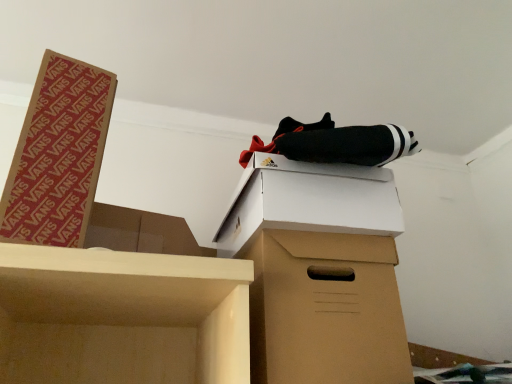
Question: Considering the relative sizes of brown cardboard box at left, which ranks as the second box in right-to-left order, and brown cardboard box at center in the image provided, is brown cardboard box at left, which ranks as the second box in right-to-left order, smaller than brown cardboard box at center?

Choices:
 (A) yes
 (B) no

Answer: (A)

Question: Can you confirm if brown cardboard box at left, the first box from the left, is positioned to the left of brown cardboard box at center?

Choices:
 (A) yes
 (B) no

Answer: (A)

Question: Is brown cardboard box at left, the first box from the left, touching brown cardboard box at center?

Choices:
 (A) no
 (B) yes

Answer: (A)

Question: From the image's perspective, is brown cardboard box at left, which ranks as the second box in right-to-left order, on brown cardboard box at center?

Choices:
 (A) no
 (B) yes

Answer: (B)

Question: Is brown cardboard box at left, which ranks as the second box in right-to-left order, taller than brown cardboard box at center?

Choices:
 (A) yes
 (B) no

Answer: (A)

Question: Does point (279, 213) appear closer or farther from the camera than point (64, 112)?

Choices:
 (A) closer
 (B) farther

Answer: (B)

Question: Looking at the image, does white cardboard box at upper center, which appears as the first box when viewed from the right, seem bigger or smaller compared to brown cardboard box at left, which ranks as the second box in right-to-left order?

Choices:
 (A) big
 (B) small

Answer: (A)

Question: Would you say white cardboard box at upper center, the second box viewed from the left, is to the left or to the right of brown cardboard box at left, the first box from the left, in the picture?

Choices:
 (A) left
 (B) right

Answer: (B)

Question: From a real-world perspective, is white cardboard box at upper center, the second box viewed from the left, above or below brown cardboard box at left, the first box from the left?

Choices:
 (A) above
 (B) below

Answer: (B)

Question: Is brown cardboard box at left, which ranks as the second box in right-to-left order, to the left or to the right of white cardboard box at upper center, the second box viewed from the left, in the image?

Choices:
 (A) left
 (B) right

Answer: (A)

Question: Looking at the image, does brown cardboard box at left, the first box from the left, seem bigger or smaller compared to white cardboard box at upper center, which appears as the first box when viewed from the right?

Choices:
 (A) small
 (B) big

Answer: (A)

Question: From the image's perspective, relative to white cardboard box at upper center, the second box viewed from the left, is brown cardboard box at left, the first box from the left, above or below?

Choices:
 (A) below
 (B) above

Answer: (B)

Question: Is point (74, 157) positioned closer to the camera than point (311, 218)?

Choices:
 (A) closer
 (B) farther

Answer: (A)

Question: Considering the relative positions of brown cardboard box at center and brown cardboard box at left, the first box from the left, in the image provided, is brown cardboard box at center to the left or to the right of brown cardboard box at left, the first box from the left,?

Choices:
 (A) right
 (B) left

Answer: (A)

Question: Is brown cardboard box at center bigger or smaller than brown cardboard box at left, which ranks as the second box in right-to-left order?

Choices:
 (A) small
 (B) big

Answer: (B)